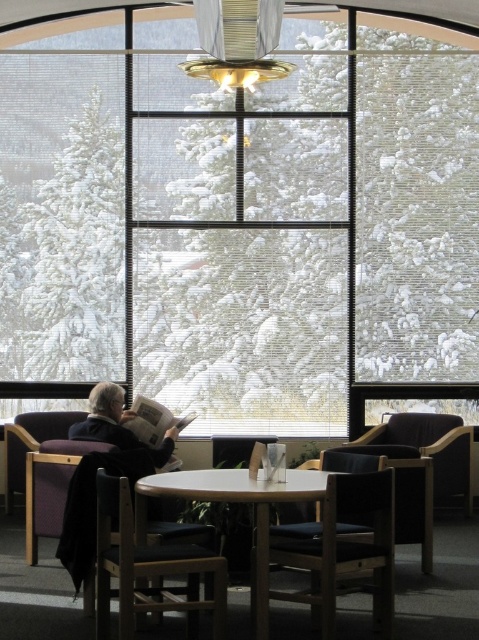
Question: Does light brown wooden table at center appear on the right side of wooden armchair at lower right?

Choices:
 (A) no
 (B) yes

Answer: (A)

Question: Which point is closer to the camera?

Choices:
 (A) (252, 576)
 (B) (467, 509)

Answer: (A)

Question: Which object is farther from the camera taking this photo?

Choices:
 (A) light brown wooden table at center
 (B) dark brown leather armchair at lower right
 (C) wooden armchair at lower right
 (D) dark wood chair at lower center

Answer: (B)

Question: Which point is closer to the camera taking this photo?

Choices:
 (A) (126, 566)
 (B) (462, 460)
 (C) (331, 502)

Answer: (A)

Question: Is transparent glass window at center to the left of dark brown leather armchair at lower right from the viewer's perspective?

Choices:
 (A) yes
 (B) no

Answer: (A)

Question: Considering the relative positions of light brown wooden table at center and dark brown leather armchair at lower right in the image provided, where is light brown wooden table at center located with respect to dark brown leather armchair at lower right?

Choices:
 (A) right
 (B) left

Answer: (B)